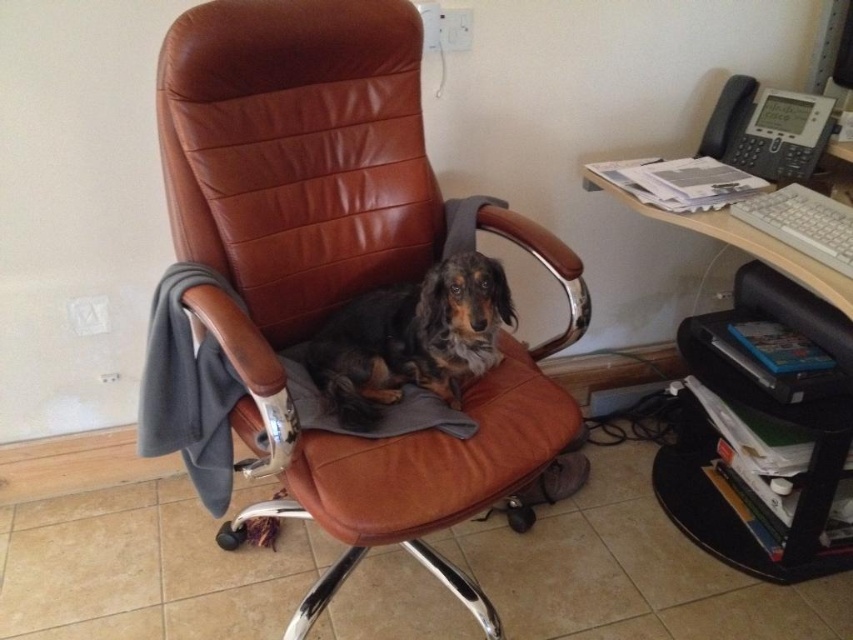
You are a delivery person who needs to place a small package between the brown leather swivel chair at center and the black leather dog at center. Which object should you place the package closer to if the dog is on the right side?

The brown leather swivel chair at center is to the left of the black leather dog at center, so you should place the package closer to the brown leather swivel chair at center if the dog is on the right side.

You are a delivery robot that needs to place a package on the black plastic computer desk at right. You are currently positioned near the black leather dog at center. Can you move the package to the desk without needing to go around any obstacles?

The black plastic computer desk at right and black leather dog at center are 25.83 inches apart. Since the distance is sufficient for the robot to move the package directly, there are no obstacles in between, so yes, the robot can move the package to the desk without needing to go around any obstacles.

You are standing in the room and want to place a small plant pot exactly at the point with coordinates point (724,236). Considering the distance of this point from you, can you estimate whether the plant pot will be placed closer to you or further away compared to the brown leather office chair?

The distance of point (724,236) from viewer is 4.49 feet, so the plant pot placed at point (724,236) will be further away compared to the brown leather office chair since the chair is presumably closer to the viewer in the scene.